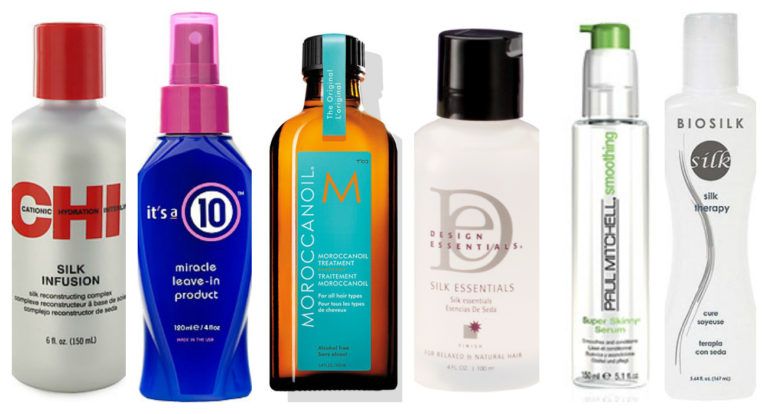
You are a GUI agent. You are given a task and a screenshot of the screen. Output one action in this format:
    pyautogui.click(x=<x>, y=<y>)
    Task: Click on the bottles
    The height and width of the screenshot is (414, 768).
    Given the screenshot: What is the action you would take?
    pyautogui.click(x=48, y=278), pyautogui.click(x=147, y=284), pyautogui.click(x=279, y=277), pyautogui.click(x=464, y=258), pyautogui.click(x=604, y=269), pyautogui.click(x=700, y=274)